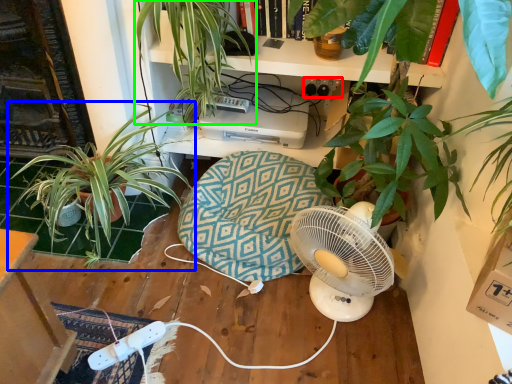
Question: Which is farther away from plug (highlighted by a red box)? houseplant (highlighted by a blue box) or houseplant (highlighted by a green box)?

Choices:
 (A) houseplant
 (B) houseplant

Answer: (A)